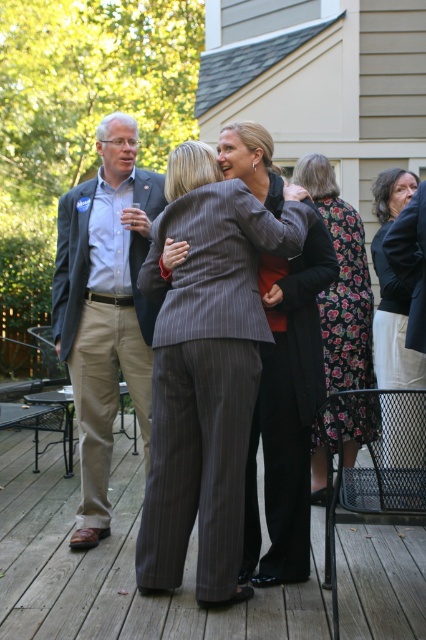
Where is the matte gray blazer at left located in the image?

The matte gray blazer at left is located at point [104,307].

You are taking a photo of the two women on the deck. Which of the two points, point (152, 336) or point (402, 296), should you focus on to ensure the woman in the gray pinstripe suit is in sharp focus?

Result: You should focus on point (152, 336) because it is closer to the camera than point (402, 296), ensuring the woman in the gray pinstripe suit is in sharp focus.

You are standing at the edge of the wooden deck at center. If you want to move towards the beige house visible in the background, which direction should you walk?

Since the wooden deck at center is located at point (118, 566), you should walk towards the direction of the beige house in the background to reach it.